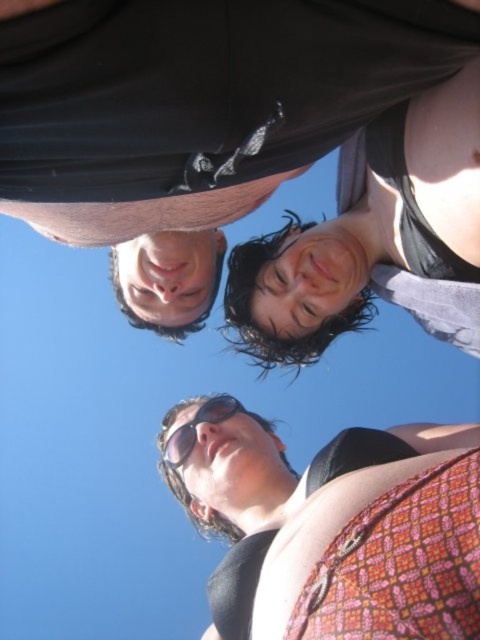
Question: Where is patterned fabric top at lower center located in relation to black reflective sunglasses at center in the image?

Choices:
 (A) right
 (B) left

Answer: (A)

Question: Which object is farther from the camera taking this photo?

Choices:
 (A) black matte shirt at upper center
 (B) black reflective sunglasses at center
 (C) patterned fabric top at lower center

Answer: (B)

Question: Is the position of black matte shirt at upper center more distant than that of patterned fabric top at lower center?

Choices:
 (A) yes
 (B) no

Answer: (B)

Question: Can you confirm if patterned fabric top at lower center is positioned to the right of black reflective sunglasses at center?

Choices:
 (A) yes
 (B) no

Answer: (A)

Question: Which object is farther from the camera taking this photo?

Choices:
 (A) black reflective sunglasses at center
 (B) patterned fabric top at lower center
 (C) black matte shirt at upper center

Answer: (A)

Question: Which point appears farthest from the camera in this image?

Choices:
 (A) pos(243,522)
 (B) pos(431,180)

Answer: (A)